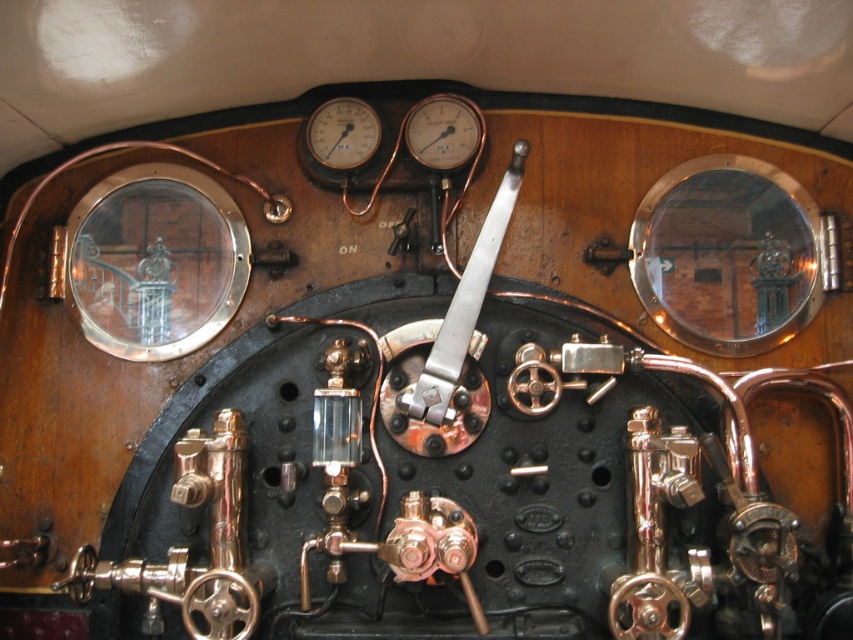
Does point (453, 161) come behind point (367, 109)?

No, it is in front of (367, 109).

Between matte black gauge at upper center and matte brass gauge at upper center, which one appears on the right side from the viewer's perspective?

matte black gauge at upper center

This screenshot has width=853, height=640. Find the location of `matte black gauge at upper center`. matte black gauge at upper center is located at coordinates (444, 131).

Identify the location of matte black gauge at upper center. This screenshot has width=853, height=640. (444, 131).